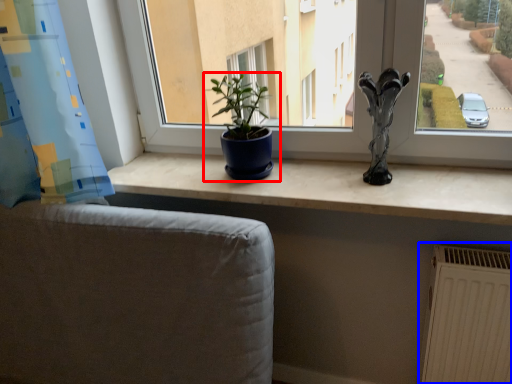
Question: Which of the following is the farthest to the observer, houseplant (highlighted by a red box) or radiator (highlighted by a blue box)?

Choices:
 (A) houseplant
 (B) radiator

Answer: (A)